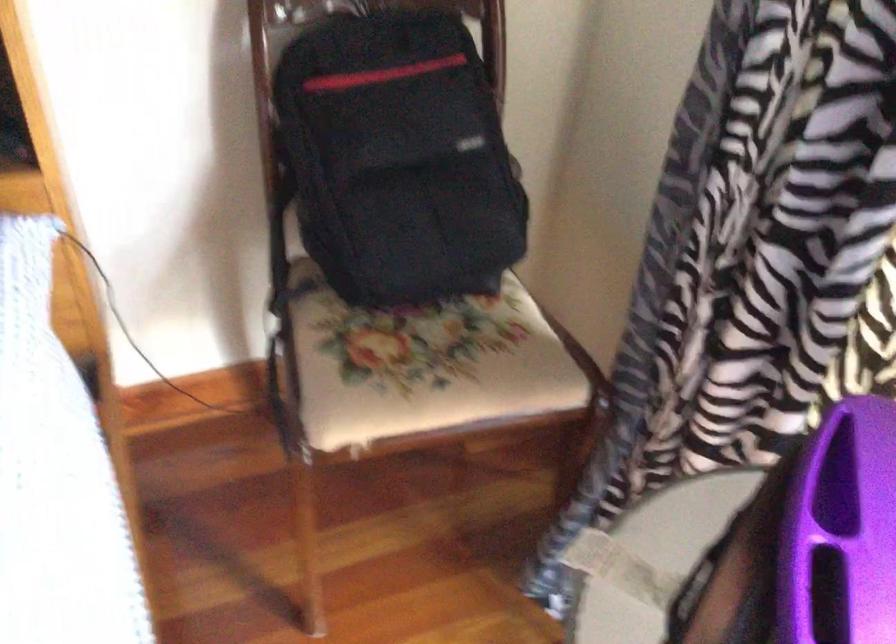
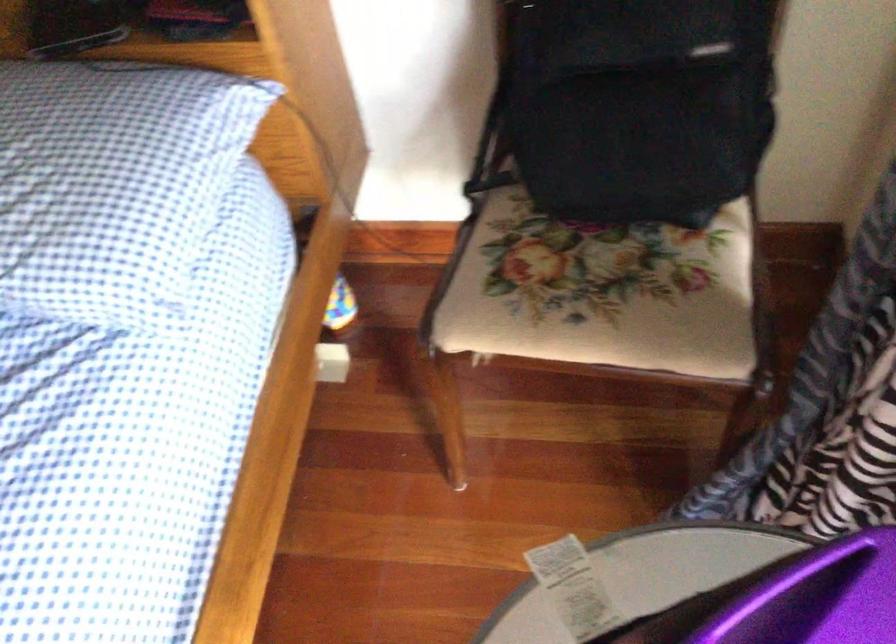
In the second image, find the point that corresponds to [449,357] in the first image.

(599, 292)